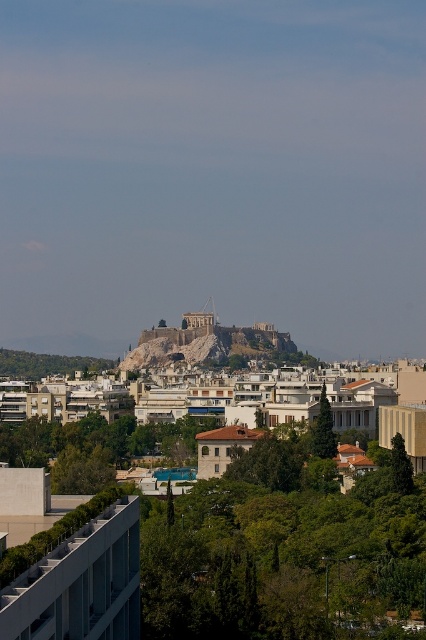
Can you confirm if green leafy tree at lower center is positioned to the right of green leafy tree at lower left?

Indeed, green leafy tree at lower center is positioned on the right side of green leafy tree at lower left.

Who is more forward, [75,426] or [34,353]?

Point [75,426] is more forward.

Locate an element on the screen. green leafy tree at lower center is located at coordinates (95, 448).

How distant is stone/rocky hill at center from green leafy tree at center?

A distance of 65.40 meters exists between stone/rocky hill at center and green leafy tree at center.

Between stone/rocky hill at center and green leafy tree at center, which one appears on the right side from the viewer's perspective?

Positioned to the right is green leafy tree at center.

The height and width of the screenshot is (640, 426). What do you see at coordinates (207, 344) in the screenshot?
I see `stone/rocky hill at center` at bounding box center [207, 344].

The width and height of the screenshot is (426, 640). Identify the location of stone/rocky hill at center. (207, 344).

Identify the location of stone/rocky hill at center. pos(207,344).

Is stone/rocky hill at center below green leafy tree at lower left?

No.

Is point (227, 356) positioned after point (6, 356)?

No.

This screenshot has width=426, height=640. I want to click on stone/rocky hill at center, so click(x=207, y=344).